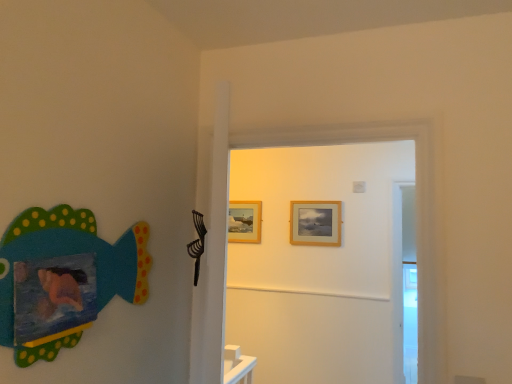
Question: Considering the relative positions of wooden door at center and wooden picture frame at center, which is the first picture frame in left-to-right order, in the image provided, is wooden door at center to the left of wooden picture frame at center, which is the first picture frame in left-to-right order, from the viewer's perspective?

Choices:
 (A) no
 (B) yes

Answer: (A)

Question: Is wooden door at center looking in the opposite direction of wooden picture frame at center, the second picture frame in the front-to-back sequence?

Choices:
 (A) no
 (B) yes

Answer: (A)

Question: Is wooden door at center wider than wooden picture frame at center, placed as the first picture frame when sorted from back to front?

Choices:
 (A) yes
 (B) no

Answer: (A)

Question: Is wooden door at center bigger than wooden picture frame at center, which is the first picture frame in left-to-right order?

Choices:
 (A) no
 (B) yes

Answer: (B)

Question: Considering the relative positions of wooden door at center and wooden picture frame at center, the second picture frame in the front-to-back sequence, in the image provided, is wooden door at center in front of wooden picture frame at center, the second picture frame in the front-to-back sequence,?

Choices:
 (A) yes
 (B) no

Answer: (A)

Question: From the image's perspective, is wooden door at center above wooden picture frame at center, placed as the first picture frame when sorted from back to front?

Choices:
 (A) no
 (B) yes

Answer: (B)

Question: Considering the relative sizes of matte painted fish at left and wooden picture frame at center, which is the first picture frame in left-to-right order, in the image provided, is matte painted fish at left taller than wooden picture frame at center, which is the first picture frame in left-to-right order,?

Choices:
 (A) yes
 (B) no

Answer: (A)

Question: Is matte painted fish at left facing towards wooden picture frame at center, acting as the 2th picture frame starting from the right?

Choices:
 (A) yes
 (B) no

Answer: (B)

Question: From a real-world perspective, is matte painted fish at left located higher than wooden picture frame at center, placed as the first picture frame when sorted from back to front?

Choices:
 (A) no
 (B) yes

Answer: (A)

Question: From the image's perspective, would you say matte painted fish at left is positioned over wooden picture frame at center, which is the first picture frame in left-to-right order?

Choices:
 (A) yes
 (B) no

Answer: (A)

Question: Is matte painted fish at left located outside wooden picture frame at center, the second picture frame in the front-to-back sequence?

Choices:
 (A) yes
 (B) no

Answer: (A)

Question: Does matte painted fish at left come in front of wooden picture frame at center, placed as the first picture frame when sorted from back to front?

Choices:
 (A) yes
 (B) no

Answer: (A)

Question: Does matte painted fish at left have a greater width compared to wooden door at center?

Choices:
 (A) no
 (B) yes

Answer: (A)